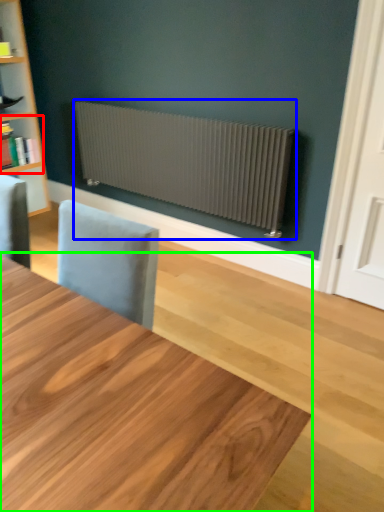
Question: Which object is positioned farthest from shelf (highlighted by a red box)? Select from radiator (highlighted by a blue box) and table (highlighted by a green box).

Choices:
 (A) radiator
 (B) table

Answer: (B)